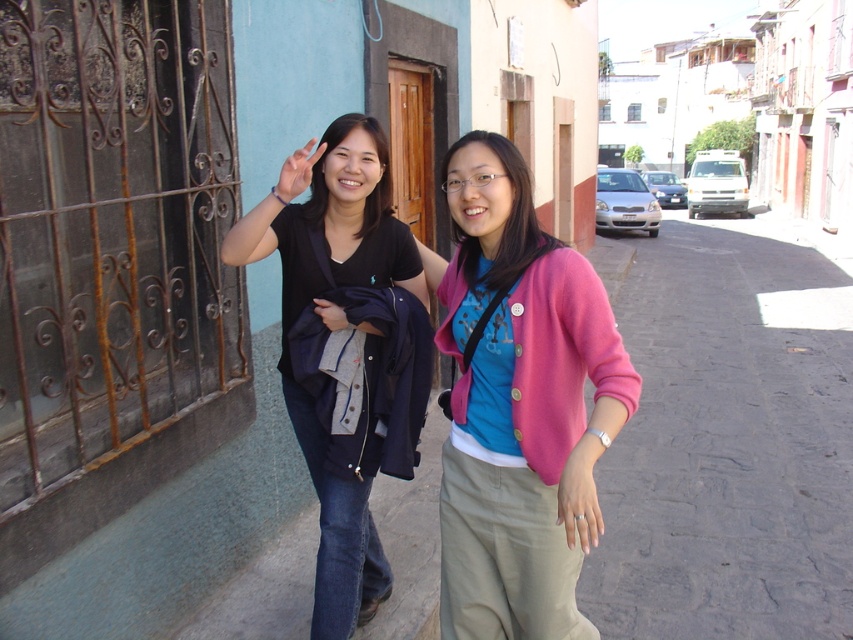
Is pink fabric cardigan at center to the right of black matte t-shirt at center from the viewer's perspective?

Correct, you'll find pink fabric cardigan at center to the right of black matte t-shirt at center.

From the picture: Between pink fabric cardigan at center and black matte t-shirt at center, which one has more height?

With more height is pink fabric cardigan at center.

Where is `pink fabric cardigan at center`? Image resolution: width=853 pixels, height=640 pixels. pink fabric cardigan at center is located at coordinates (520, 406).